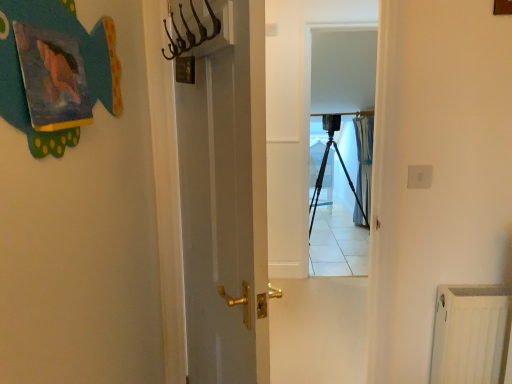
Question: Considering the relative sizes of blue sheer curtain at center and black matte tripod at center in the image provided, is blue sheer curtain at center smaller than black matte tripod at center?

Choices:
 (A) no
 (B) yes

Answer: (B)

Question: From the image's perspective, would you say blue sheer curtain at center is shown under black matte tripod at center?

Choices:
 (A) no
 (B) yes

Answer: (A)

Question: Is blue sheer curtain at center taller than black matte tripod at center?

Choices:
 (A) yes
 (B) no

Answer: (A)

Question: Is blue sheer curtain at center far away from black matte tripod at center?

Choices:
 (A) yes
 (B) no

Answer: (B)

Question: Is blue sheer curtain at center wider than black matte tripod at center?

Choices:
 (A) yes
 (B) no

Answer: (B)

Question: Is white glossy screen door at center, acting as the first screen door starting from the left, bigger or smaller than transparent plastic screen door at center, placed as the 2th screen door when sorted from left to right?

Choices:
 (A) small
 (B) big

Answer: (B)

Question: Does point (335, 19) appear closer or farther from the camera than point (352, 163)?

Choices:
 (A) farther
 (B) closer

Answer: (B)

Question: From a real-world perspective, is white glossy screen door at center, the second screen door viewed from the back, physically located above or below transparent plastic screen door at center, which is the first screen door in right-to-left order?

Choices:
 (A) below
 (B) above

Answer: (B)

Question: From the image's perspective, is white glossy screen door at center, which is the 2th screen door from right to left, above or below transparent plastic screen door at center, the 1th screen door when ordered from back to front?

Choices:
 (A) above
 (B) below

Answer: (B)

Question: Is white glossy screen door at center, the 1th screen door in the front-to-back sequence, wider or thinner than blue sheer curtain at center?

Choices:
 (A) wide
 (B) thin

Answer: (B)

Question: From the image's perspective, is white glossy screen door at center, acting as the first screen door starting from the left, above or below blue sheer curtain at center?

Choices:
 (A) below
 (B) above

Answer: (A)

Question: In terms of size, does white glossy screen door at center, acting as the first screen door starting from the left, appear bigger or smaller than blue sheer curtain at center?

Choices:
 (A) big
 (B) small

Answer: (B)

Question: From a real-world perspective, relative to blue sheer curtain at center, is white glossy screen door at center, the 1th screen door in the front-to-back sequence, vertically above or below?

Choices:
 (A) below
 (B) above

Answer: (B)

Question: Would you say black matte tripod at center is to the left or to the right of blue sheer curtain at center in the picture?

Choices:
 (A) left
 (B) right

Answer: (A)

Question: Is black matte tripod at center taller or shorter than blue sheer curtain at center?

Choices:
 (A) tall
 (B) short

Answer: (B)